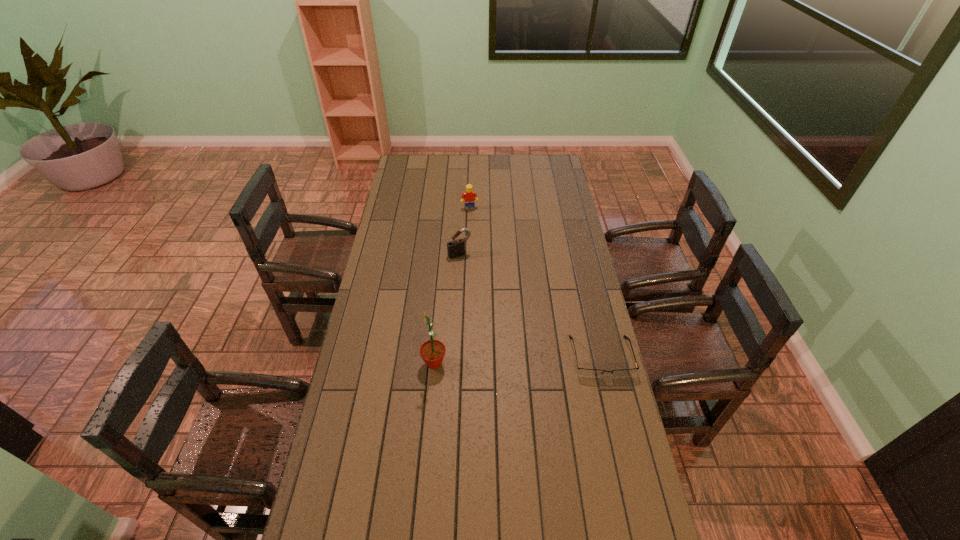
At what (x,y) coordinates should I click in order to perform the action: click on the tallest object. Please return your answer as a coordinate pair (x, y). Looking at the image, I should click on (432, 351).

Identify the location of the rightmost object. [590, 373].

This screenshot has width=960, height=540. I want to click on spectacles, so click(590, 373).

Identify the location of the third nearest object. (456, 248).

The height and width of the screenshot is (540, 960). In order to click on Lego in this screenshot , I will do `click(469, 194)`.

You are a GUI agent. You are given a task and a screenshot of the screen. Output one action in this format:
    pyautogui.click(x=<x>, y=<y>)
    Task: Click on the vacant space located on the face of the sunflower
    
    Given the screenshot: What is the action you would take?
    pyautogui.click(x=404, y=363)

At what (x,y) coordinates should I click in order to perform the action: click on vacant space located 0.050m on the face of the sunflower. Please return your answer as a coordinate pair (x, y). Looking at the image, I should click on (407, 363).

You are a GUI agent. You are given a task and a screenshot of the screen. Output one action in this format:
    pyautogui.click(x=<x>, y=<y>)
    Task: Click on the vacant area situated 0.120m on the face of the sunflower
    Image resolution: width=960 pixels, height=540 pixels.
    Given the screenshot: What is the action you would take?
    pyautogui.click(x=387, y=363)

Locate an element on the screen. This screenshot has height=540, width=960. vacant space located 0.320m on the front-facing side of the rightmost object is located at coordinates (629, 476).

Identify the location of vacant space located with the keyhole on the front of the padlock. (471, 272).